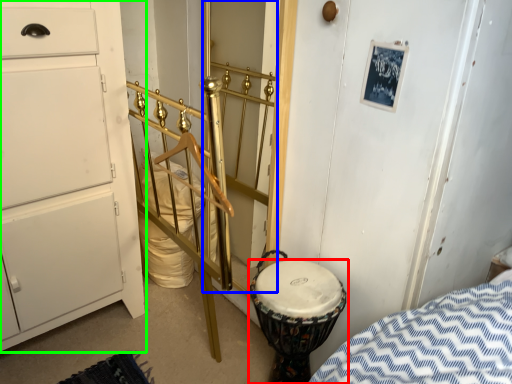
Question: Which is farther away from drum (highlighted by a red box)? door (highlighted by a blue box) or chest of drawers (highlighted by a green box)?

Choices:
 (A) door
 (B) chest of drawers

Answer: (B)